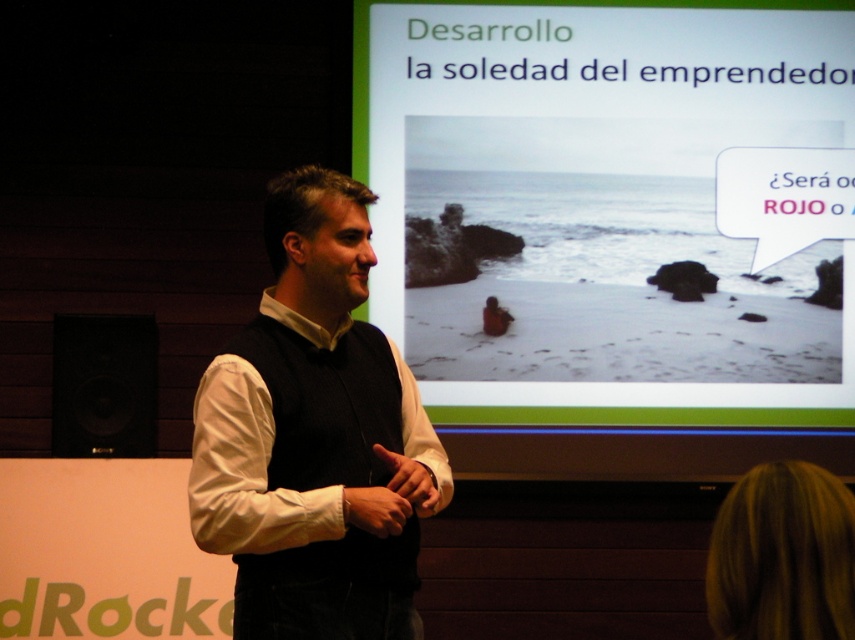
You are a photographer who needs to capture a closeup shot of both the matte plastic screen at upper center and the white matte vest at center. The camera you are using has a minimum focusing distance of 1.5 meters. Can you take the photo without moving the camera or the subjects?

The matte plastic screen at upper center and white matte vest at center are 1.61 meters apart. Since the minimum focusing distance of the camera is 1.5 meters, which is less than the distance between the two objects, you can take the photo without moving the camera or the subjects.

From the picture: You are a photographer who needs to capture a clear shot of both the white matte vest at center and the black matte speaker at lower left. Based on their positions, which object should you focus on first to ensure both are in frame?

The white matte vest at center is to the right of the black matte speaker at lower left. To ensure both are in frame, focus on the black matte speaker at lower left first, then adjust the camera to include the white matte vest at center to the right of it.

You are organizing a photo shoot for a clothing brand. You have two items to feature in the image, the white matte vest at center and the black matte speaker at lower left. The brand wants to highlight the vest as the main focus. Based on the scene description, which object is larger and thus better suited to be the main focus?

The white matte vest at center is larger in size compared to the black matte speaker at lower left, making it the better choice for the main focus as it naturally draws more attention due to its size.